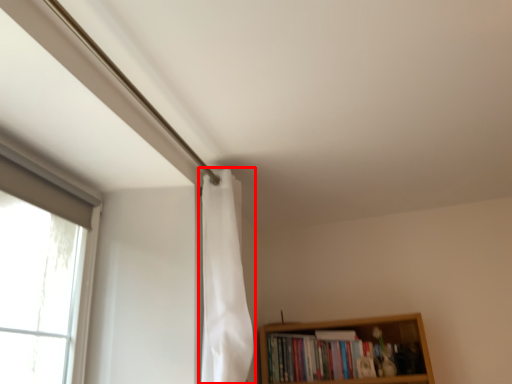
Question: Considering the relative positions of shower curtain (annotated by the red box) and book in the image provided, where is shower curtain (annotated by the red box) located with respect to the staircase?

Choices:
 (A) right
 (B) left

Answer: (B)